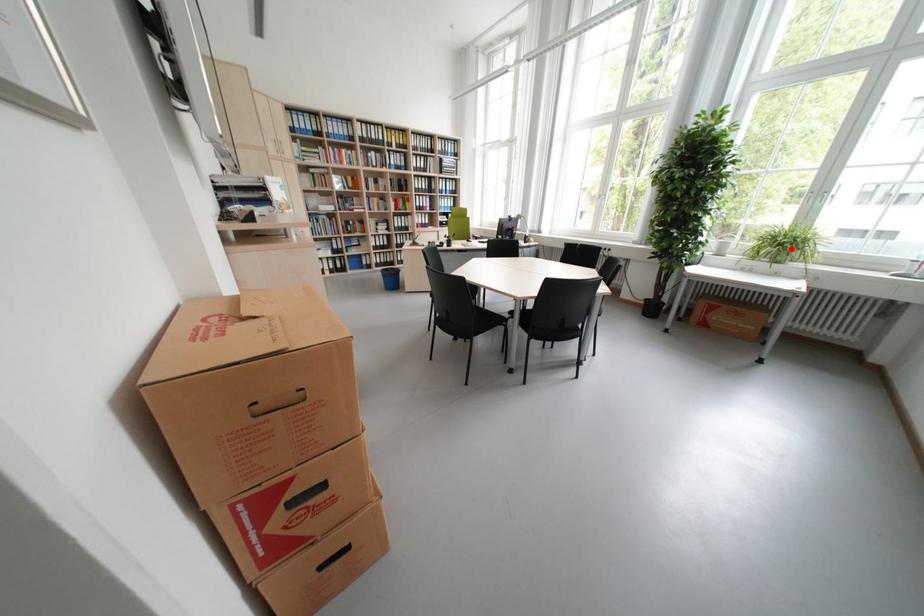
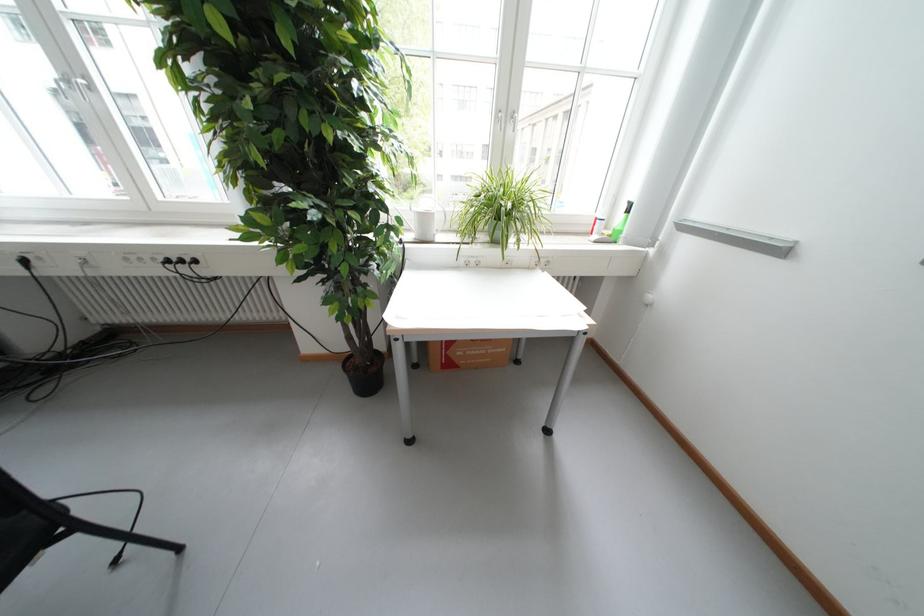
Find the pixel in the second image that matches the highlighted location in the first image.

(508, 217)